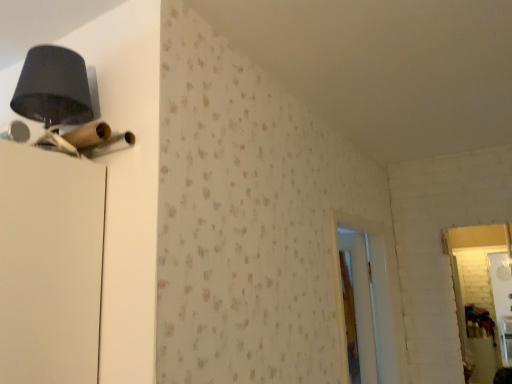
The image size is (512, 384). Describe the element at coordinates (371, 294) in the screenshot. I see `white wooden screen door at center` at that location.

Measure the distance between white wooden screen door at center and camera.

white wooden screen door at center and camera are 5.78 feet apart from each other.

In the scene shown: In order to face white wooden screen door at center, should I rotate leftwards or rightwards?

Rotate your view right by about 15.494°.

Find the location of `white wooden screen door at center`. white wooden screen door at center is located at coordinates (371, 294).

The width and height of the screenshot is (512, 384). What do you see at coordinates (54, 92) in the screenshot?
I see `matte black lampshade at upper left` at bounding box center [54, 92].

Image resolution: width=512 pixels, height=384 pixels. In order to click on matte black lampshade at upper left in this screenshot , I will do `click(54, 92)`.

The height and width of the screenshot is (384, 512). In order to click on white wooden screen door at center in this screenshot , I will do `click(371, 294)`.

Is white wooden screen door at center to the left of matte black lampshade at upper left from the viewer's perspective?

No, white wooden screen door at center is not to the left of matte black lampshade at upper left.

Is white wooden screen door at center in front of or behind matte black lampshade at upper left in the image?

white wooden screen door at center is behind matte black lampshade at upper left.

Considering the points (375, 281) and (57, 97), which point is behind, point (375, 281) or point (57, 97)?

Positioned behind is point (375, 281).

From the image's perspective, is white wooden screen door at center positioned above or below matte black lampshade at upper left?

white wooden screen door at center is situated lower than matte black lampshade at upper left in the image.

From the picture: From a real-world perspective, which object stands above the other?

matte black lampshade at upper left is physically above.

Is white wooden screen door at center thinner than matte black lampshade at upper left?

Yes, white wooden screen door at center is thinner than matte black lampshade at upper left.

Is white wooden screen door at center taller than matte black lampshade at upper left?

Correct, white wooden screen door at center is much taller as matte black lampshade at upper left.

Is white wooden screen door at center bigger than matte black lampshade at upper left?

Correct, white wooden screen door at center is larger in size than matte black lampshade at upper left.

Is matte black lampshade at upper left inside white wooden screen door at center?

No, matte black lampshade at upper left is not surrounded by white wooden screen door at center.

Is the surface of white wooden screen door at center in direct contact with matte black lampshade at upper left?

No, white wooden screen door at center is not touching matte black lampshade at upper left.

Is white wooden screen door at center facing towards matte black lampshade at upper left?

No, white wooden screen door at center is not turned towards matte black lampshade at upper left.

How different are the orientations of white wooden screen door at center and matte black lampshade at upper left in degrees?

87.5 degrees separate the facing orientations of white wooden screen door at center and matte black lampshade at upper left.

Measure the distance from white wooden screen door at center to matte black lampshade at upper left.

white wooden screen door at center and matte black lampshade at upper left are 1.52 meters apart.

Identify the location of screen door beneath the matte black lampshade at upper left (from a real-world perspective). (371, 294).

Visually, is matte black lampshade at upper left positioned to the left or to the right of white wooden screen door at center?

From the image, it's evident that matte black lampshade at upper left is to the left of white wooden screen door at center.

In the image, is matte black lampshade at upper left positioned in front of or behind white wooden screen door at center?

In the image, matte black lampshade at upper left appears in front of white wooden screen door at center.

Which is further, (78,119) or (358,295)?

The point (358,295) is more distant.

From the image's perspective, who appears lower, matte black lampshade at upper left or white wooden screen door at center?

white wooden screen door at center.

From a real-world perspective, which is physically above, matte black lampshade at upper left or white wooden screen door at center?

matte black lampshade at upper left.

Between matte black lampshade at upper left and white wooden screen door at center, which one has larger width?

Wider between the two is matte black lampshade at upper left.

In terms of height, does matte black lampshade at upper left look taller or shorter compared to white wooden screen door at center?

Clearly, matte black lampshade at upper left is shorter compared to white wooden screen door at center.

Considering the sizes of objects matte black lampshade at upper left and white wooden screen door at center in the image provided, who is smaller, matte black lampshade at upper left or white wooden screen door at center?

With smaller size is matte black lampshade at upper left.

Is white wooden screen door at center inside matte black lampshade at upper left?

No, white wooden screen door at center is not inside matte black lampshade at upper left.

Is matte black lampshade at upper left positioned far away from white wooden screen door at center?

Yes.

Could you tell me if matte black lampshade at upper left is turned towards white wooden screen door at center?

No, matte black lampshade at upper left is not turned towards white wooden screen door at center.

How many degrees apart are the facing directions of matte black lampshade at upper left and white wooden screen door at center?

matte black lampshade at upper left and white wooden screen door at center are facing 87.5 degrees away from each other.

How much distance is there between matte black lampshade at upper left and white wooden screen door at center?

The distance of matte black lampshade at upper left from white wooden screen door at center is 1.52 meters.

This screenshot has width=512, height=384. There is a white wooden screen door at center. Identify the location of table lamp above it (from a real-world perspective). (54, 92).

What are the coordinates of `screen door below the matte black lampshade at upper left (from the image's perspective)` in the screenshot? It's located at (371, 294).

Where is `table lamp to the left of white wooden screen door at center`? The height and width of the screenshot is (384, 512). table lamp to the left of white wooden screen door at center is located at coordinates (54, 92).